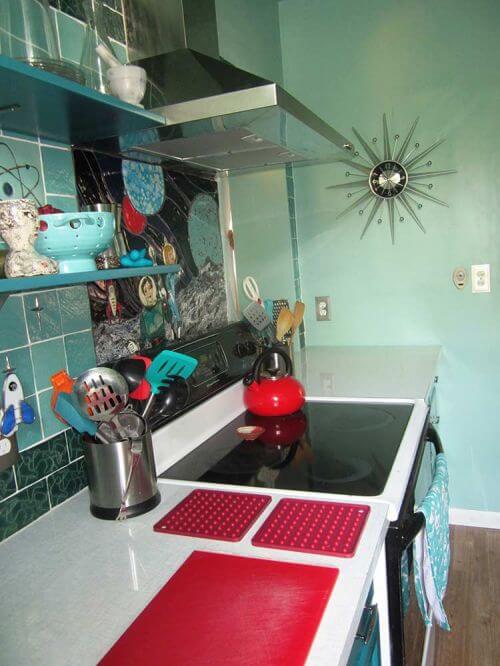
The height and width of the screenshot is (666, 500). I want to click on oven, so click(x=407, y=603).